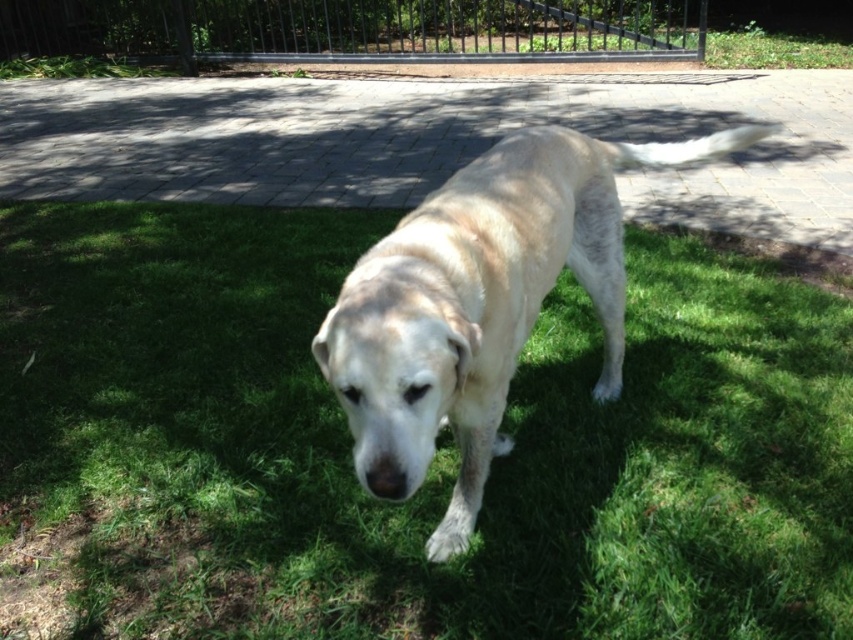
You are standing at the edge of the paved brick area and want to walk to the light beige fur dog at center without stepping on the green grass at center. Which direction should you walk towards?

Since the green grass at center is on the left side of the light beige fur dog at center, you should walk towards the right side of the light beige fur dog at center to avoid stepping on the green grass at center.

You are a dog owner trying to decide where your dog can comfortably walk. Based on the scene, which area has more space for the dog to move around freely between the green grass at center and the black metal fence at upper center?

The green grass at center has more space for the dog to move freely since it is thinner than the black metal fence at upper center, implying it occupies less area.

You are a photographer trying to capture the light beige fur dog at center and the black metal fence at upper center in the same frame. Based on their positions, which object is closer to the camera?

The light beige fur dog at center is closer to the camera because it is located below the black metal fence at upper center, indicating that the fence is in the background.